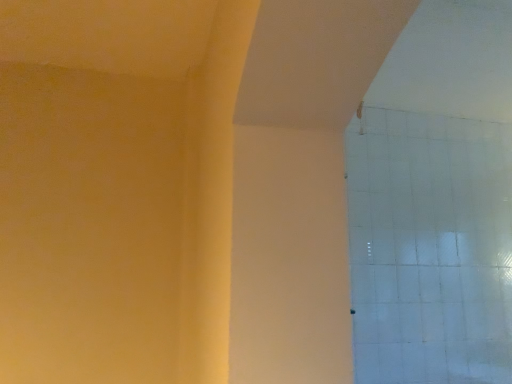
Image resolution: width=512 pixels, height=384 pixels. Describe the element at coordinates (430, 248) in the screenshot. I see `white glossy glass door at upper right` at that location.

What is the approximate height of white glossy glass door at upper right?

white glossy glass door at upper right is 31.67 inches tall.

I want to click on white glossy glass door at upper right, so click(430, 248).

Where is `white glossy glass door at upper right`? This screenshot has width=512, height=384. white glossy glass door at upper right is located at coordinates (430, 248).